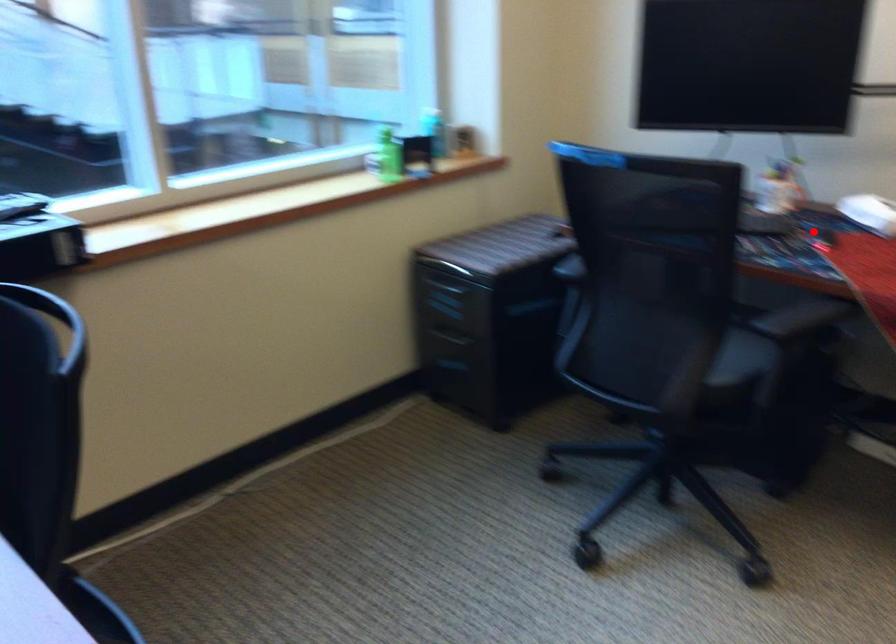
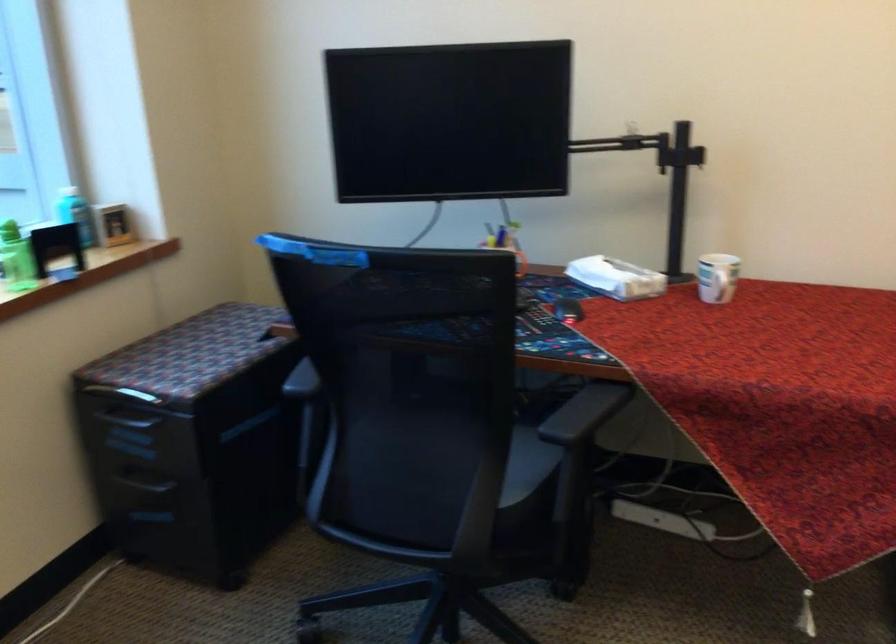
In the second image, find the point that corresponds to the highlighted location in the first image.

(567, 308)